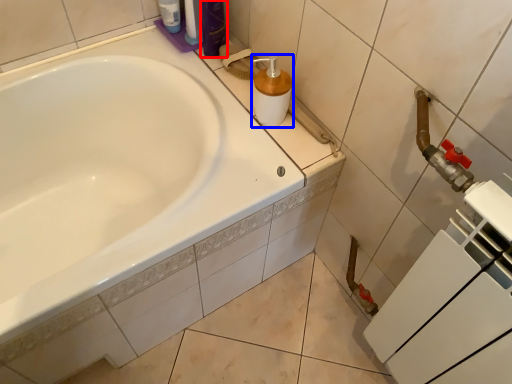
Question: Among these objects, which one is nearest to the camera, toiletry (highlighted by a red box) or soap dispenser (highlighted by a blue box)?

Choices:
 (A) toiletry
 (B) soap dispenser

Answer: (B)